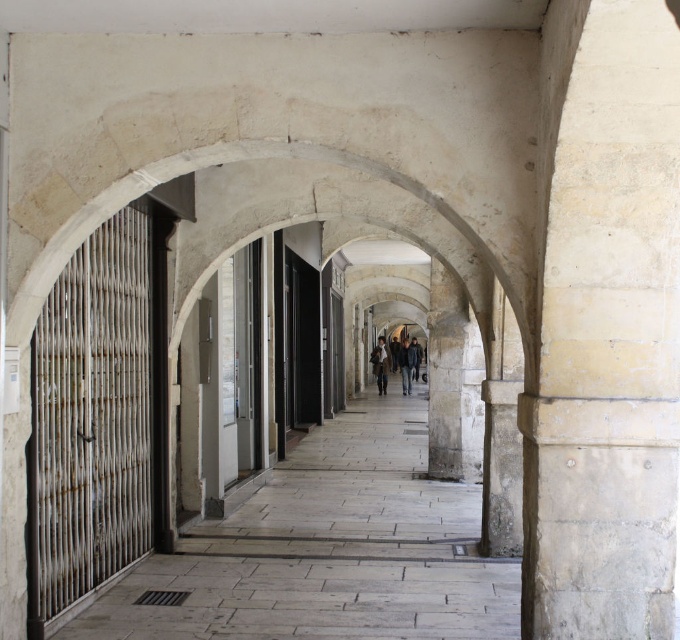
Does metallic gate at left have a greater height compared to dark gray coat at center?

In fact, metallic gate at left may be shorter than dark gray coat at center.

How far apart are metallic gate at left and dark gray coat at center?

They are 18.37 meters apart.

Between point (248, 620) and point (390, 353), which one is positioned behind?

Point (390, 353)

The image size is (680, 640). Identify the location of metallic gate at left. (326, 550).

Does light beige stone pillar at center have a smaller size compared to dark blue jeans at center?

Correct, light beige stone pillar at center occupies less space than dark blue jeans at center.

Between point (624, 74) and point (411, 356), which one is positioned in front?

Positioned in front is point (624, 74).

Who is more distant from viewer, (545, 547) or (403, 371)?

Positioned behind is point (403, 371).

Locate an element on the screen. This screenshot has height=640, width=680. light beige stone pillar at center is located at coordinates (607, 342).

Is metallic gate at left to the left of dark blue jeans at center from the viewer's perspective?

Yes, metallic gate at left is to the left of dark blue jeans at center.

Is metallic gate at left taller than dark blue jeans at center?

Incorrect, metallic gate at left's height is not larger of dark blue jeans at center's.

Identify the location of metallic gate at left. The height and width of the screenshot is (640, 680). (326, 550).